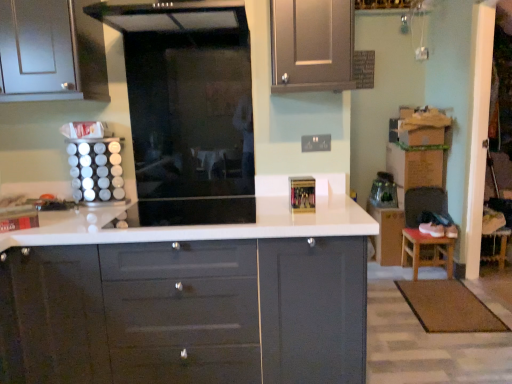
Question: Could you tell me if transparent glass door at center is facing white glossy spice rack at left?

Choices:
 (A) no
 (B) yes

Answer: (A)

Question: Is transparent glass door at center thinner than white glossy spice rack at left?

Choices:
 (A) no
 (B) yes

Answer: (B)

Question: Does transparent glass door at center contain white glossy spice rack at left?

Choices:
 (A) yes
 (B) no

Answer: (B)

Question: Is transparent glass door at center positioned far away from white glossy spice rack at left?

Choices:
 (A) yes
 (B) no

Answer: (B)

Question: Is transparent glass door at center positioned in front of white glossy spice rack at left?

Choices:
 (A) yes
 (B) no

Answer: (B)

Question: Is point (211, 190) positioned closer to the camera than point (416, 274)?

Choices:
 (A) farther
 (B) closer

Answer: (B)

Question: Is transparent glass door at center inside or outside of brown wooden stool at lower right?

Choices:
 (A) outside
 (B) inside

Answer: (A)

Question: Is transparent glass door at center wider or thinner than brown wooden stool at lower right?

Choices:
 (A) thin
 (B) wide

Answer: (A)

Question: From the image's perspective, is transparent glass door at center positioned above or below brown wooden stool at lower right?

Choices:
 (A) above
 (B) below

Answer: (A)

Question: Is point (83, 147) positioned closer to the camera than point (400, 248)?

Choices:
 (A) closer
 (B) farther

Answer: (A)

Question: Is white glossy spice rack at left spatially inside brown wooden stool at lower right, or outside of it?

Choices:
 (A) inside
 (B) outside

Answer: (B)

Question: In the image, is white glossy spice rack at left positioned in front of or behind brown wooden stool at lower right?

Choices:
 (A) front
 (B) behind

Answer: (A)

Question: From the image's perspective, is white glossy spice rack at left positioned above or below brown wooden stool at lower right?

Choices:
 (A) below
 (B) above

Answer: (B)

Question: Is transparent glass door at center wider or thinner than white glossy countertop at center?

Choices:
 (A) wide
 (B) thin

Answer: (B)

Question: From the image's perspective, relative to white glossy countertop at center, is transparent glass door at center above or below?

Choices:
 (A) above
 (B) below

Answer: (A)